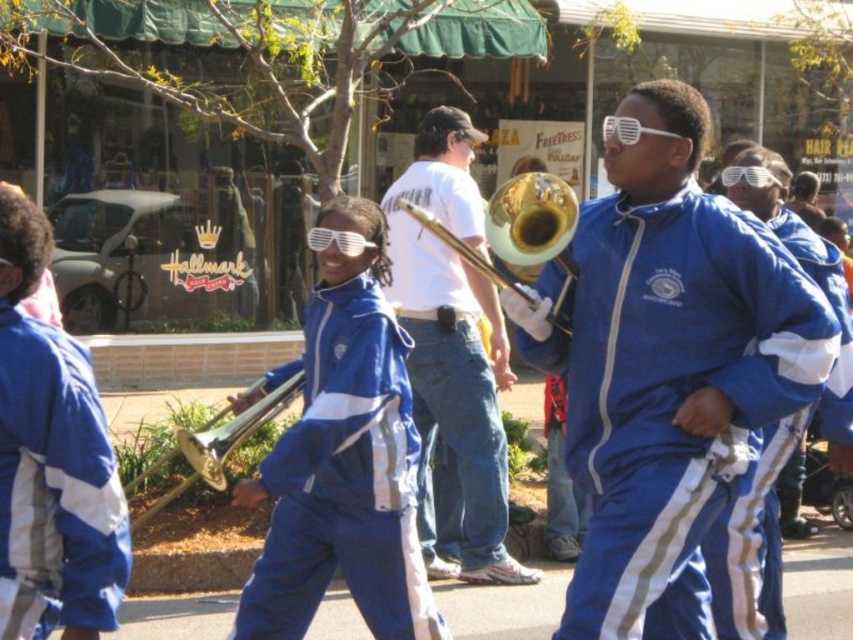
Question: Where is blue matte jacket at center located in relation to gold shiny trumpet at center in the image?

Choices:
 (A) left
 (B) right

Answer: (B)

Question: Which of the following is the closest to the observer?

Choices:
 (A) gold/yellow brass trumpet at center
 (B) matte blue tracksuit at center
 (C) blue matte jacket at center

Answer: (B)

Question: Which of these objects is positioned farthest from the blue matte uniform at center?

Choices:
 (A) gold shiny trumpet at center
 (B) white plastic trombone at center
 (C) gold brass trumpet at center

Answer: (B)

Question: From the image, what is the correct spatial relationship of white plastic trombone at center in relation to gold brass trumpet at center?

Choices:
 (A) right
 (B) left

Answer: (A)

Question: Which object is the farthest from the blue matte uniform at center?

Choices:
 (A) blue/white track suit at left
 (B) gold shiny trumpet at center
 (C) gold/yellow brass trumpet at center

Answer: (A)

Question: Observing the image, what is the correct spatial positioning of blue/white track suit at left in reference to blue matte jacket at center?

Choices:
 (A) above
 (B) below

Answer: (B)